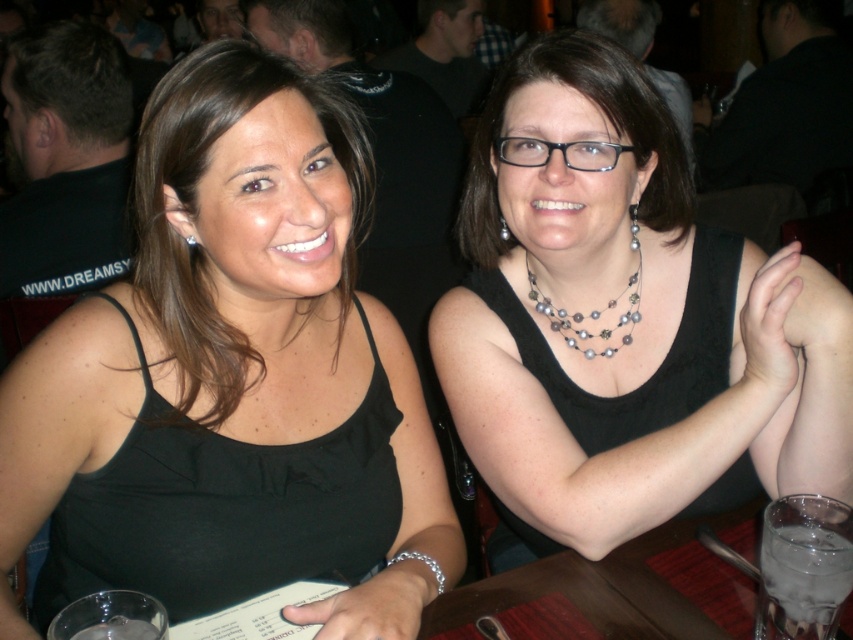
Question: Considering the relative positions of black matte tank top at center and brown wooden table at lower center in the image provided, where is black matte tank top at center located with respect to brown wooden table at lower center?

Choices:
 (A) below
 (B) above

Answer: (B)

Question: Considering the real-world distances, which object is closest to the black matte tank top at center?

Choices:
 (A) pearl/pearl-like beads necklace at center
 (B) silver metallic earring at upper left
 (C) black fabric tank top at center

Answer: (B)

Question: Does black fabric tank top at center appear on the right side of pearl/pearl-like beads necklace at center?

Choices:
 (A) no
 (B) yes

Answer: (B)

Question: Is black fabric tank top at center to the right of brown wooden table at lower center from the viewer's perspective?

Choices:
 (A) no
 (B) yes

Answer: (B)

Question: Which object is closer to the camera taking this photo?

Choices:
 (A) silver metallic earring at upper left
 (B) black matte tank top at center

Answer: (B)

Question: Which point is closer to the camera?

Choices:
 (A) (648, 621)
 (B) (527, 380)
 (C) (637, 310)

Answer: (A)